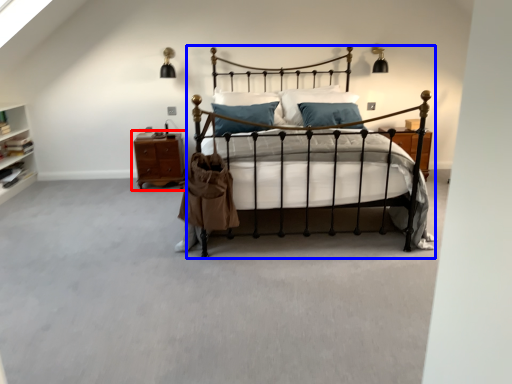
Question: Among these objects, which one is nearest to the camera, nightstand (highlighted by a red box) or bed (highlighted by a blue box)?

Choices:
 (A) nightstand
 (B) bed

Answer: (B)